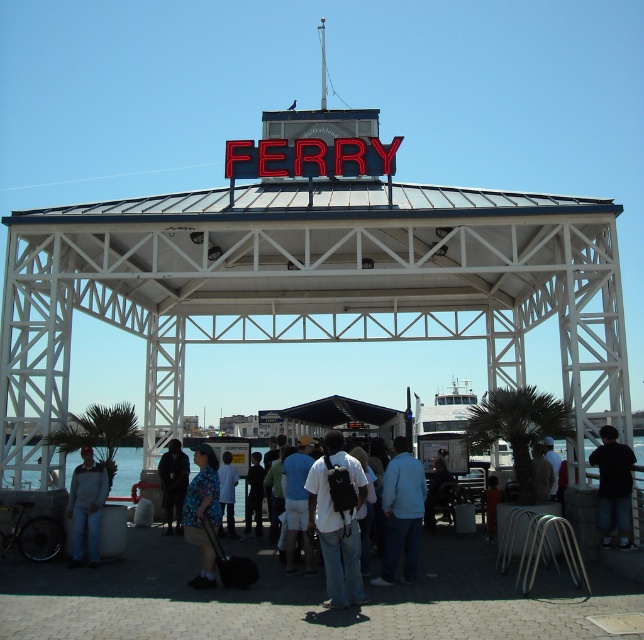
Question: Is matte black backpack at center below blue fabric backpack at center?

Choices:
 (A) no
 (B) yes

Answer: (A)

Question: Does dark blue jeans at lower left appear under white matte shirt at center?

Choices:
 (A) no
 (B) yes

Answer: (A)

Question: Which of the following is the farthest from the observer?

Choices:
 (A) (256, 516)
 (B) (442, 499)

Answer: (A)

Question: Which point appears farthest from the camera in this image?

Choices:
 (A) (316, 508)
 (B) (401, 518)
 (C) (547, 438)
 (D) (229, 488)

Answer: (D)

Question: Where is blue fabric backpack at center located in relation to dark brown leather jacket at center in the image?

Choices:
 (A) right
 (B) left

Answer: (A)

Question: Which of these objects is positioned farthest from the blue printed shirt at center?

Choices:
 (A) light brown leather jacket at center
 (B) dark blue shirt at center

Answer: (A)